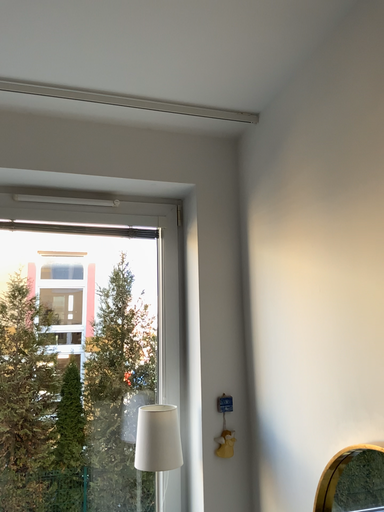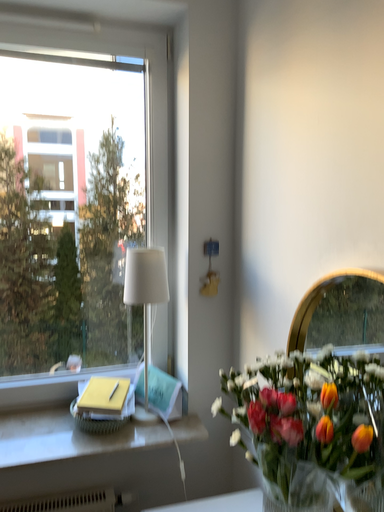
Question: Which way did the camera rotate in the video?

Choices:
 (A) rotated downward
 (B) rotated upward

Answer: (A)